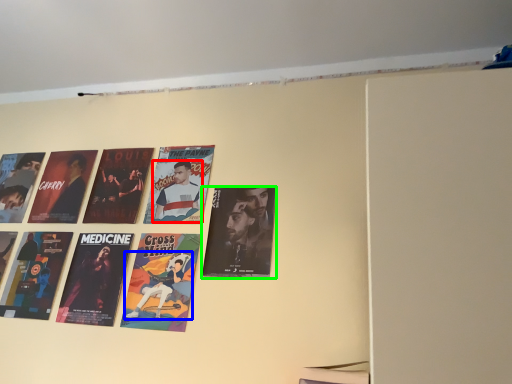
Question: Considering the real-world distances, which object is closest to person (highlighted by a red box)? person (highlighted by a blue box) or poster (highlighted by a green box).

Choices:
 (A) person
 (B) poster

Answer: (B)